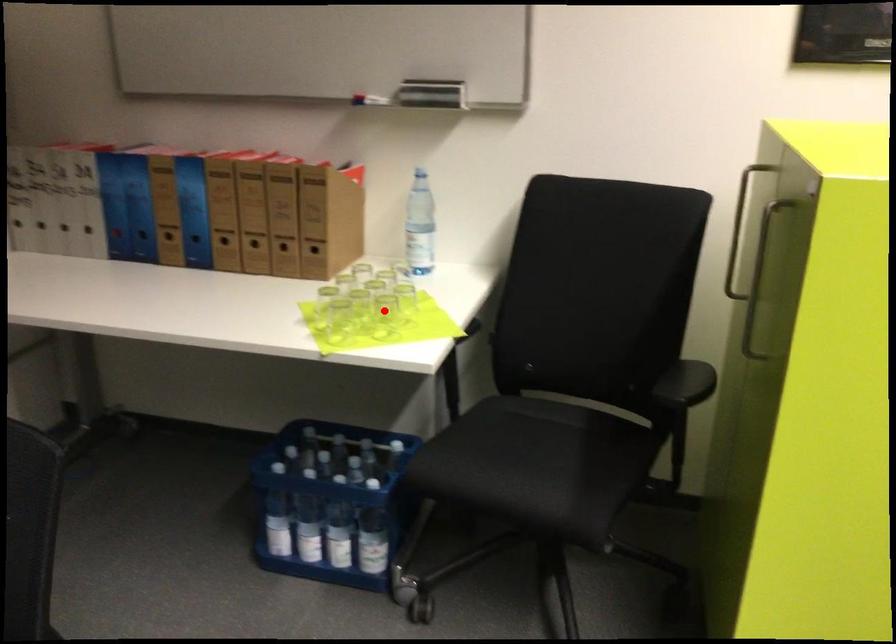
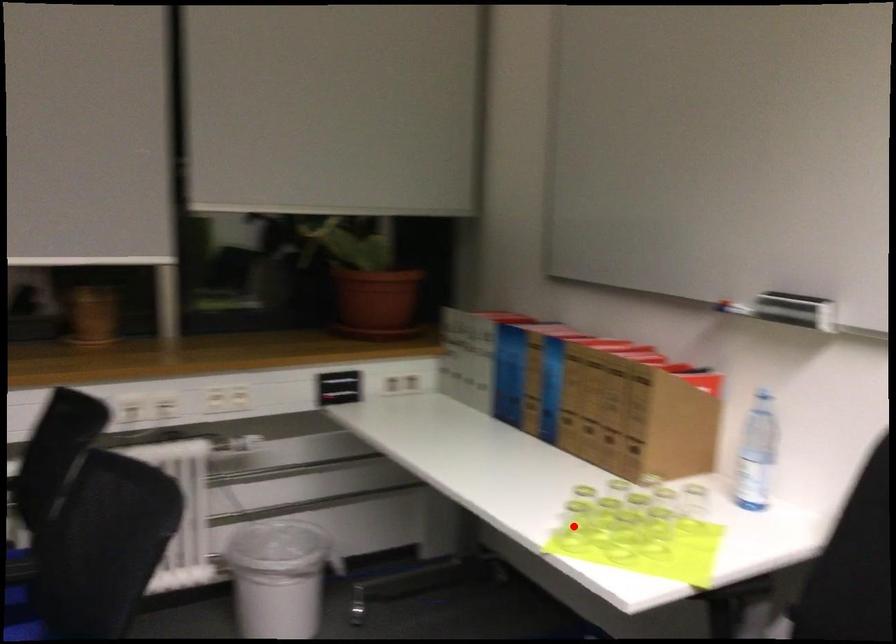
I am providing you with two images of the same scene from different viewpoints. A red point is marked on the first image and another point is marked on the second image. Is the marked point in image1 the same physical position as the marked point in image2?

No